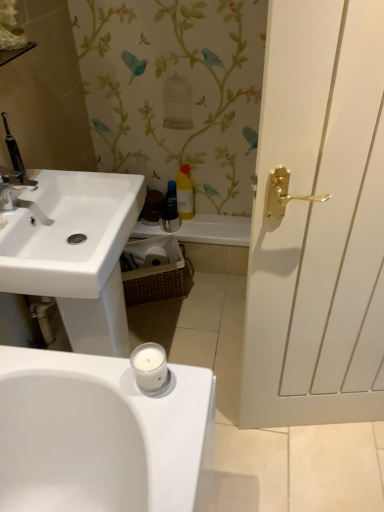
The height and width of the screenshot is (512, 384). Find the location of `vacant space in front of white wood door at right`. vacant space in front of white wood door at right is located at coordinates (329, 475).